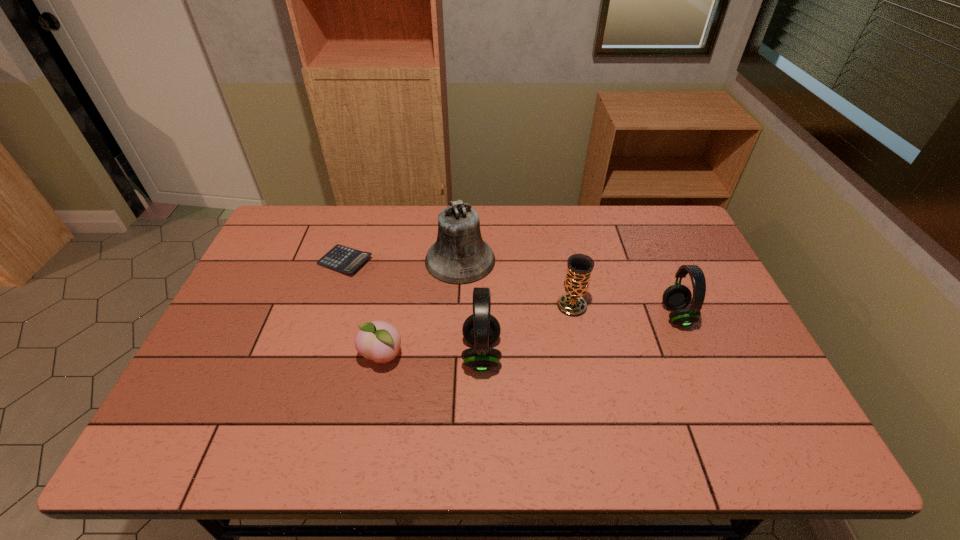
All headsets are currently evenly spaced. To continue this pattern, where would you add another headset on the left? Please point out a vacant spot. Please provide its 2D coordinates. Your answer should be formatted as a tuple, i.e. [(x, y)], where the tuple contains the x and y coordinates of a point satisfying the conditions above.

[(251, 400)]